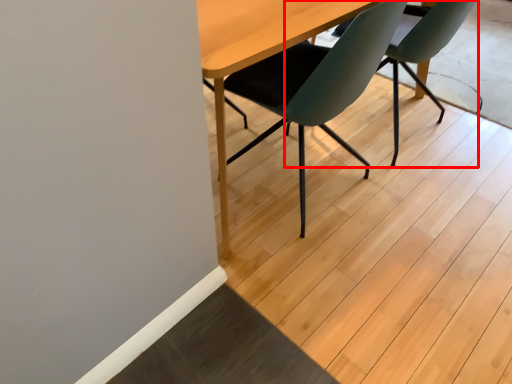
Question: In this image, where is chair (annotated by the red box) located relative to chair?

Choices:
 (A) right
 (B) left

Answer: (A)